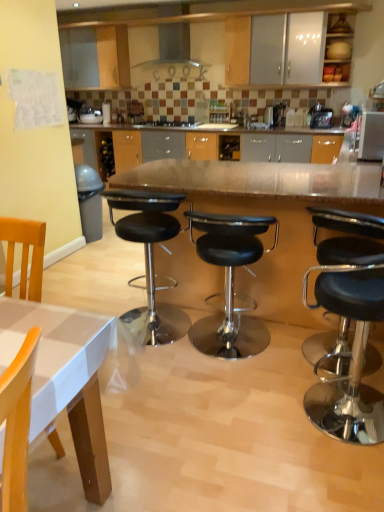
Question: Is black leather stool at right, which is the third stool from left to right, not near matte wood cabinet at upper right?

Choices:
 (A) yes
 (B) no

Answer: (A)

Question: Does black leather stool at right, which is counted as the 1th stool, starting from the right, appear on the right side of matte wood cabinet at upper right?

Choices:
 (A) yes
 (B) no

Answer: (B)

Question: From a real-world perspective, is black leather stool at right, which is the third stool from left to right, on top of matte wood cabinet at upper right?

Choices:
 (A) no
 (B) yes

Answer: (A)

Question: Could you tell me if black leather stool at right, which is the third stool from left to right, is turned towards matte wood cabinet at upper right?

Choices:
 (A) no
 (B) yes

Answer: (B)

Question: From the image's perspective, is black leather stool at right, which is counted as the 1th stool, starting from the right, beneath matte wood cabinet at upper right?

Choices:
 (A) yes
 (B) no

Answer: (A)

Question: Looking at their shapes, would you say satin silver microwave at upper right is wider or thinner than black leather stool at right, which is counted as the 1th stool, starting from the right?

Choices:
 (A) thin
 (B) wide

Answer: (A)

Question: Is point (380, 113) positioned closer to the camera than point (360, 279)?

Choices:
 (A) closer
 (B) farther

Answer: (B)

Question: Considering their positions, is satin silver microwave at upper right located in front of or behind black leather stool at right, which is counted as the 1th stool, starting from the right?

Choices:
 (A) behind
 (B) front

Answer: (A)

Question: From a real-world perspective, is satin silver microwave at upper right physically located above or below black leather stool at right, which is the third stool from left to right?

Choices:
 (A) above
 (B) below

Answer: (A)

Question: Considering the positions of matte wood cabinet at upper right and black leather stool at center, positioned as the 2th stool in left-to-right order, in the image, is matte wood cabinet at upper right wider or thinner than black leather stool at center, positioned as the 2th stool in left-to-right order,?

Choices:
 (A) wide
 (B) thin

Answer: (B)

Question: Is matte wood cabinet at upper right to the left or to the right of black leather stool at center, the 2th stool viewed from the right, in the image?

Choices:
 (A) left
 (B) right

Answer: (B)

Question: Is matte wood cabinet at upper right taller or shorter than black leather stool at center, positioned as the 2th stool in left-to-right order?

Choices:
 (A) tall
 (B) short

Answer: (B)

Question: From the image's perspective, is matte wood cabinet at upper right above or below black leather stool at center, the 2th stool viewed from the right?

Choices:
 (A) above
 (B) below

Answer: (A)

Question: Do you think satin silver microwave at upper right is within black leather stool at center, positioned as the 2th stool in left-to-right order, or outside of it?

Choices:
 (A) outside
 (B) inside

Answer: (A)

Question: From a real-world perspective, is satin silver microwave at upper right physically located above or below black leather stool at center, positioned as the 2th stool in left-to-right order?

Choices:
 (A) below
 (B) above

Answer: (B)